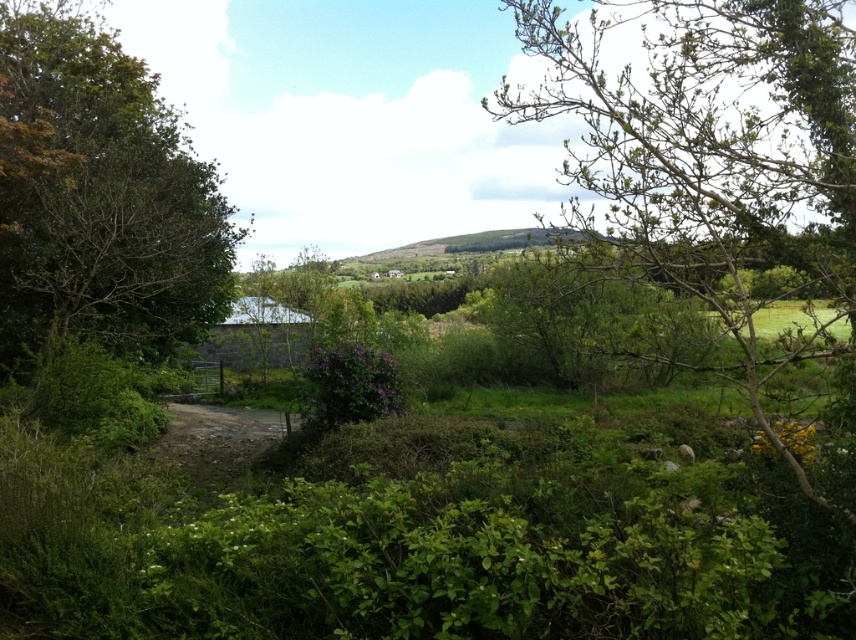
From the picture: You are an artist sketching this rural landscape. You want to draw the bare branches at upper right and the green leafy tree at left. Which object should you sketch first if you want to follow the rule of thumb that thinner objects are sketched before thicker ones?

The bare branches at upper right should be sketched first because it is thinner than the green leafy tree at left, following the rule of thumb that thinner objects are sketched before thicker ones.

You are an artist sketching this landscape. You want to ensure the bare branches at upper right and the green leafy tree at left are proportionally accurate. Which object should you draw smaller in your sketch?

The bare branches at upper right should be drawn smaller since it is not as tall as the green leafy tree at left.